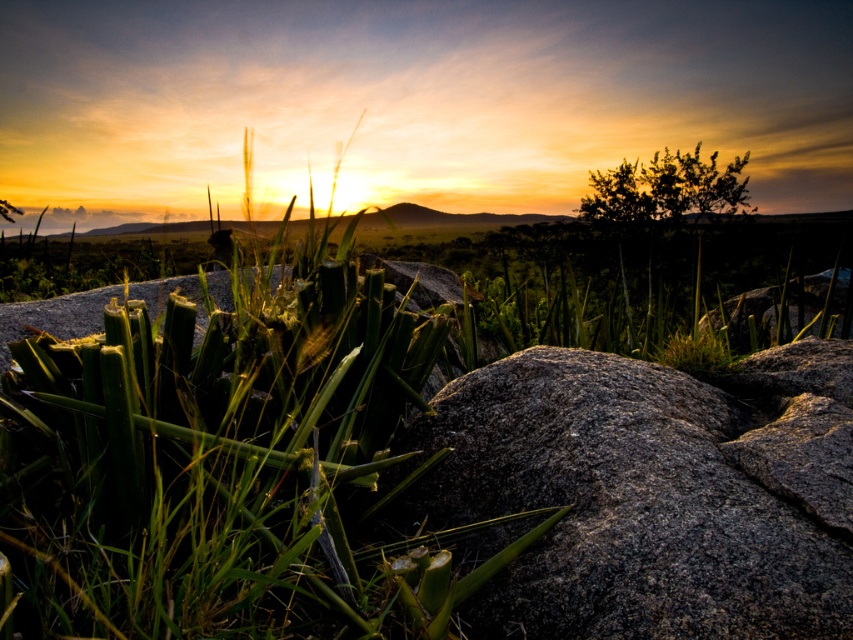
Question: Observing the image, what is the correct spatial positioning of green rough grass at center in reference to granite rock at center?

Choices:
 (A) above
 (B) below

Answer: (A)

Question: Which object appears closest to the camera in this image?

Choices:
 (A) granite rock at center
 (B) green rough grass at center

Answer: (B)

Question: Is green rough grass at center below granite rock at center?

Choices:
 (A) no
 (B) yes

Answer: (A)

Question: Is green rough grass at center wider than granite rock at center?

Choices:
 (A) yes
 (B) no

Answer: (B)